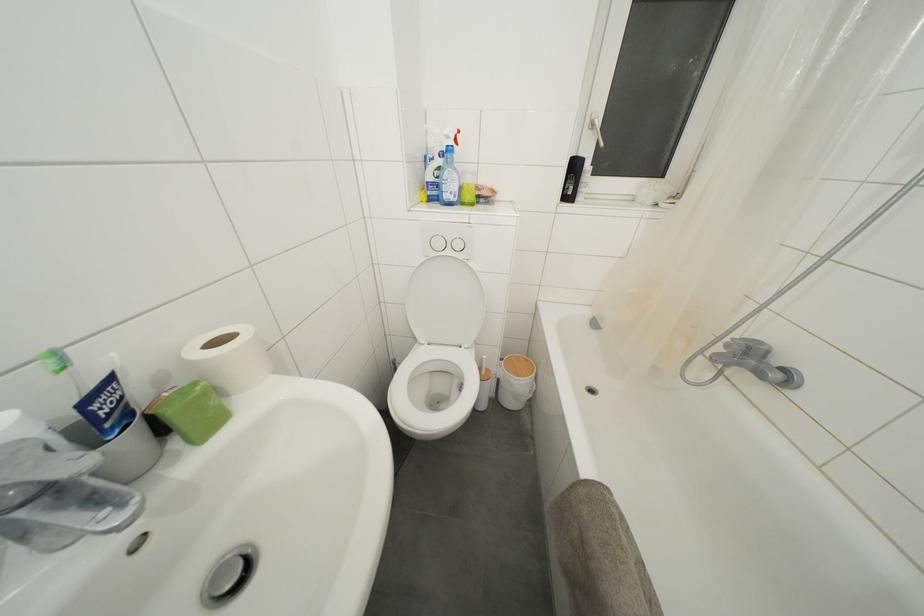
Locate an element on the screen. This screenshot has width=924, height=616. green bar soap is located at coordinates (192, 411).